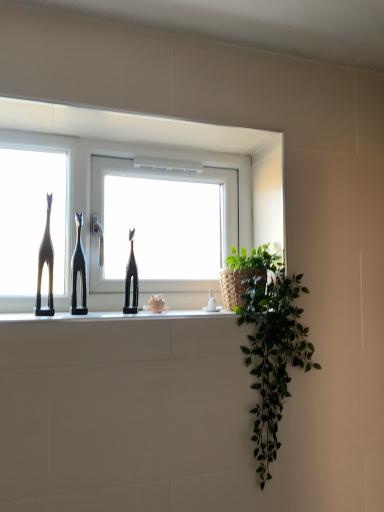
What do you see at coordinates (43, 265) in the screenshot? The image size is (384, 512). I see `matte black giraffe at left` at bounding box center [43, 265].

What are the coordinates of `white glossy window at center` in the screenshot? It's located at (150, 195).

What do you see at coordinates (150, 195) in the screenshot?
I see `white glossy window at center` at bounding box center [150, 195].

Identify the location of black glossy giraffe at center, which appears as the 2th sculpture when viewed from the left. (132, 279).

Measure the distance between black glossy giraffe at center, which appears as the 2th sculpture when viewed from the left, and camera.

The distance of black glossy giraffe at center, which appears as the 2th sculpture when viewed from the left, from camera is 4.17 feet.

This screenshot has width=384, height=512. What do you see at coordinates (78, 272) in the screenshot? I see `black matte cat at center, positioned as the 1th sculpture in left-to-right order` at bounding box center [78, 272].

Locate an element on the screen. The height and width of the screenshot is (512, 384). matte black giraffe at left is located at coordinates (43, 265).

In the scene shown: Is there a large distance between matte black giraffe at left and black glossy giraffe at center, marked as the first sculpture in a right-to-left arrangement?

matte black giraffe at left is near black glossy giraffe at center, marked as the first sculpture in a right-to-left arrangement, not far away.

Between matte black giraffe at left and black glossy giraffe at center, marked as the first sculpture in a right-to-left arrangement, which one is positioned behind?

black glossy giraffe at center, marked as the first sculpture in a right-to-left arrangement, is more distant.

From a real-world perspective, count 2nd sculptures downward from the matte black giraffe at left and point to it. Please provide its 2D coordinates.

[(132, 279)]

Who is taller, black matte cat at center, positioned as the 1th sculpture in left-to-right order, or matte black giraffe at left?

With more height is matte black giraffe at left.

Considering the relative positions of black matte cat at center, placed as the 2th sculpture when sorted from right to left, and matte black giraffe at left in the image provided, is black matte cat at center, placed as the 2th sculpture when sorted from right to left, to the left of matte black giraffe at left from the viewer's perspective?

No.

Identify the location of the 1st sculpture to the right of the matte black giraffe at left, starting your count from the anchor. (78, 272).

What's the angular difference between black matte cat at center, placed as the 2th sculpture when sorted from right to left, and matte black giraffe at left's facing directions?

They differ by 0.000629 degrees in their facing directions.

Consider the image. Is white glossy window at center shorter than black matte cat at center, positioned as the 1th sculpture in left-to-right order?

No, white glossy window at center is not shorter than black matte cat at center, positioned as the 1th sculpture in left-to-right order.

Does point (175, 243) come in front of point (77, 308)?

That is False.

From a real-world perspective, relative to black matte cat at center, positioned as the 1th sculpture in left-to-right order, is white glossy window at center vertically above or below?

In terms of real-world spatial position, white glossy window at center is above black matte cat at center, positioned as the 1th sculpture in left-to-right order.

Considering the positions of objects white glossy window at center and black matte cat at center, placed as the 2th sculpture when sorted from right to left, in the image provided, who is more to the left, white glossy window at center or black matte cat at center, placed as the 2th sculpture when sorted from right to left,?

black matte cat at center, placed as the 2th sculpture when sorted from right to left.

How many degrees apart are the facing directions of matte black giraffe at left and white glossy window at center?

0.297 degrees.

Considering the positions of points (49, 239) and (57, 296), is point (49, 239) farther from camera compared to point (57, 296)?

No, it is not.

In terms of size, does matte black giraffe at left appear bigger or smaller than white glossy window at center?

Considering their sizes, matte black giraffe at left takes up less space than white glossy window at center.

How distant is matte black giraffe at left from white glossy window at center?

matte black giraffe at left and white glossy window at center are 12.54 inches apart from each other.

Could you tell me if black glossy giraffe at center, marked as the first sculpture in a right-to-left arrangement, is facing matte black giraffe at left?

No, black glossy giraffe at center, marked as the first sculpture in a right-to-left arrangement, is not oriented towards matte black giraffe at left.

Is black glossy giraffe at center, marked as the first sculpture in a right-to-left arrangement, bigger or smaller than matte black giraffe at left?

In the image, black glossy giraffe at center, marked as the first sculpture in a right-to-left arrangement, appears to be smaller than matte black giraffe at left.

Between black glossy giraffe at center, marked as the first sculpture in a right-to-left arrangement, and matte black giraffe at left, which one appears on the right side from the viewer's perspective?

Positioned to the right is black glossy giraffe at center, marked as the first sculpture in a right-to-left arrangement.

How much distance is there between black glossy giraffe at center, marked as the first sculpture in a right-to-left arrangement, and matte black giraffe at left?

black glossy giraffe at center, marked as the first sculpture in a right-to-left arrangement, and matte black giraffe at left are 9.78 inches apart.

Consider the image. Is white glossy window at center positioned with its back to black glossy giraffe at center, which appears as the 2th sculpture when viewed from the left?

Yes.

Are white glossy window at center and black glossy giraffe at center, marked as the first sculpture in a right-to-left arrangement, far apart?

No, there isn't a large distance between white glossy window at center and black glossy giraffe at center, marked as the first sculpture in a right-to-left arrangement.

In the image, is white glossy window at center positioned in front of or behind black glossy giraffe at center, which appears as the 2th sculpture when viewed from the left?

Clearly, white glossy window at center is behind black glossy giraffe at center, which appears as the 2th sculpture when viewed from the left.

Identify the location of window behind the black glossy giraffe at center, marked as the first sculpture in a right-to-left arrangement. The width and height of the screenshot is (384, 512). (150, 195).

Is black glossy giraffe at center, marked as the first sculpture in a right-to-left arrangement, facing away from black matte cat at center, placed as the 2th sculpture when sorted from right to left?

No, black glossy giraffe at center, marked as the first sculpture in a right-to-left arrangement, is not facing the opposite direction of black matte cat at center, placed as the 2th sculpture when sorted from right to left.

Considering the relative sizes of black glossy giraffe at center, which appears as the 2th sculpture when viewed from the left, and black matte cat at center, placed as the 2th sculpture when sorted from right to left, in the image provided, is black glossy giraffe at center, which appears as the 2th sculpture when viewed from the left, taller than black matte cat at center, placed as the 2th sculpture when sorted from right to left,?

Incorrect, the height of black glossy giraffe at center, which appears as the 2th sculpture when viewed from the left, is not larger of that of black matte cat at center, placed as the 2th sculpture when sorted from right to left.

In the image, is black glossy giraffe at center, which appears as the 2th sculpture when viewed from the left, positioned in front of or behind black matte cat at center, placed as the 2th sculpture when sorted from right to left?

In the image, black glossy giraffe at center, which appears as the 2th sculpture when viewed from the left, appears behind black matte cat at center, placed as the 2th sculpture when sorted from right to left.

From the image's perspective, is black glossy giraffe at center, which appears as the 2th sculpture when viewed from the left, on top of black matte cat at center, positioned as the 1th sculpture in left-to-right order?

Actually, black glossy giraffe at center, which appears as the 2th sculpture when viewed from the left, appears below black matte cat at center, positioned as the 1th sculpture in left-to-right order, in the image.

You are a GUI agent. You are given a task and a screenshot of the screen. Output one action in this format:
    pyautogui.click(x=<x>, y=<y>)
    Task: Click on the giraffe to the left of black glossy giraffe at center, marked as the first sculpture in a right-to-left arrangement
    The width and height of the screenshot is (384, 512).
    Given the screenshot: What is the action you would take?
    pyautogui.click(x=43, y=265)

Find the location of `giraffe above the black matte cat at center, positioned as the 1th sculpture in left-to-right order (from the image's perspective)`. giraffe above the black matte cat at center, positioned as the 1th sculpture in left-to-right order (from the image's perspective) is located at coordinates click(43, 265).

From the image, which object appears to be farther from white glossy window at center, matte black giraffe at left or black glossy giraffe at center, which appears as the 2th sculpture when viewed from the left?

matte black giraffe at left lies further to white glossy window at center than the other object.

From the image, which object appears to be farther from black glossy giraffe at center, which appears as the 2th sculpture when viewed from the left, matte black giraffe at left or white glossy window at center?

matte black giraffe at left lies further to black glossy giraffe at center, which appears as the 2th sculpture when viewed from the left, than the other object.

Looking at the image, which one is located closer to white glossy window at center, matte black giraffe at left or black matte cat at center, positioned as the 1th sculpture in left-to-right order?

The object closer to white glossy window at center is black matte cat at center, positioned as the 1th sculpture in left-to-right order.

Looking at the image, which one is located closer to matte black giraffe at left, white glossy window at center or black glossy giraffe at center, which appears as the 2th sculpture when viewed from the left?

Based on the image, black glossy giraffe at center, which appears as the 2th sculpture when viewed from the left, appears to be nearer to matte black giraffe at left.

From the image, which object appears to be farther from black matte cat at center, placed as the 2th sculpture when sorted from right to left, matte black giraffe at left or white glossy window at center?

white glossy window at center.

Estimate the real-world distances between objects in this image. Which object is closer to black matte cat at center, positioned as the 1th sculpture in left-to-right order, black glossy giraffe at center, marked as the first sculpture in a right-to-left arrangement, or matte black giraffe at left?

matte black giraffe at left.

Based on their spatial positions, is white glossy window at center or matte black giraffe at left closer to black glossy giraffe at center, which appears as the 2th sculpture when viewed from the left?

Among the two, white glossy window at center is located nearer to black glossy giraffe at center, which appears as the 2th sculpture when viewed from the left.

Looking at the image, which one is located further to matte black giraffe at left, white glossy window at center or black matte cat at center, placed as the 2th sculpture when sorted from right to left?

The object further to matte black giraffe at left is white glossy window at center.

The height and width of the screenshot is (512, 384). In order to click on sculpture situated between matte black giraffe at left and black glossy giraffe at center, which appears as the 2th sculpture when viewed from the left, from left to right in this screenshot , I will do `click(78, 272)`.

Locate an element on the screen. Image resolution: width=384 pixels, height=512 pixels. window between black matte cat at center, placed as the 2th sculpture when sorted from right to left, and black glossy giraffe at center, which appears as the 2th sculpture when viewed from the left is located at coordinates (150, 195).

Where is `window between matte black giraffe at left and black glossy giraffe at center, which appears as the 2th sculpture when viewed from the left, in the horizontal direction`? This screenshot has width=384, height=512. window between matte black giraffe at left and black glossy giraffe at center, which appears as the 2th sculpture when viewed from the left, in the horizontal direction is located at coordinates (150, 195).

You are a GUI agent. You are given a task and a screenshot of the screen. Output one action in this format:
    pyautogui.click(x=<x>, y=<y>)
    Task: Click on the sculpture between matte black giraffe at left and white glossy window at center in the horizontal direction
    The height and width of the screenshot is (512, 384).
    Given the screenshot: What is the action you would take?
    pyautogui.click(x=78, y=272)